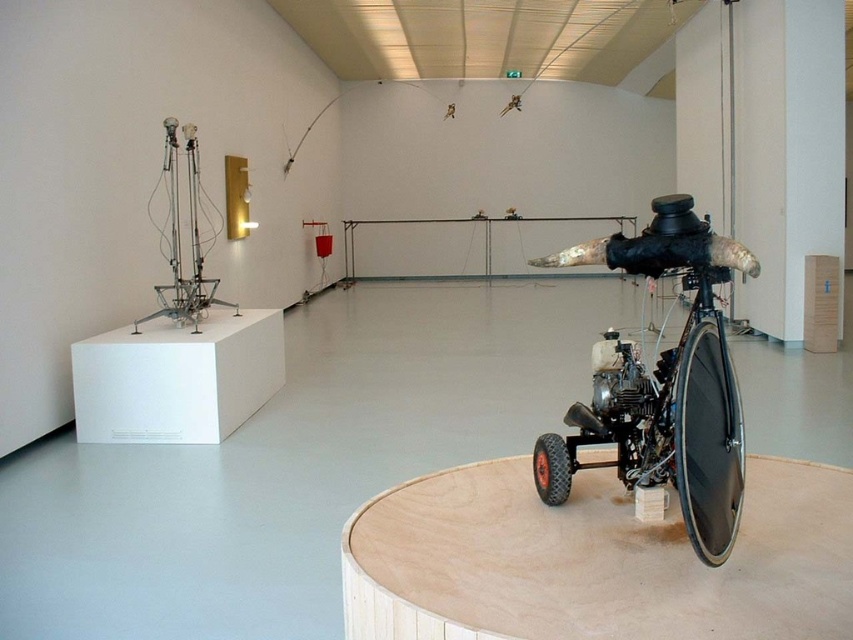
Please use the coordinates provided to determine the position of the black rubber wheel at lower right relative to the center of the image. Is it located to the left or right of the center?

The black rubber wheel at lower right is located at coordinates point (708,442). Since the x coordinate 0.692 is greater than 0.5, it is to the right of the center.